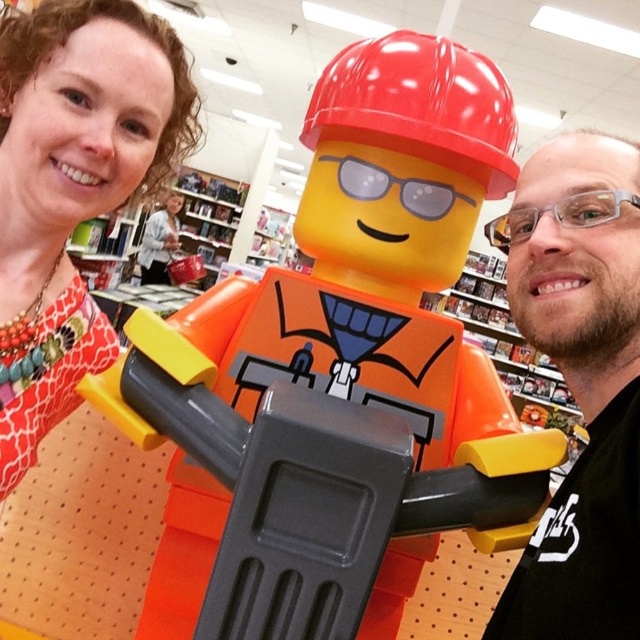
Question: Considering the relative positions of matte orange dress at center and transparent plastic goggles at right in the image provided, where is matte orange dress at center located with respect to transparent plastic goggles at right?

Choices:
 (A) above
 (B) below

Answer: (B)

Question: Which of these objects is positioned closest to the transparent plastic goggles at right?

Choices:
 (A) matte orange plastic construction worker at center
 (B) transparent plastic goggles at center
 (C) matte gray sweater at center
 (D) matte black shirt at center

Answer: (D)

Question: Which is farther from the matte black shirt at center?

Choices:
 (A) matte orange dress at center
 (B) transparent plastic goggles at center
 (C) transparent plastic goggles at right

Answer: (A)

Question: Observing the image, what is the correct spatial positioning of matte black shirt at center in reference to transparent plastic goggles at center?

Choices:
 (A) left
 (B) right

Answer: (B)

Question: Does matte orange plastic construction worker at center have a smaller size compared to matte black shirt at center?

Choices:
 (A) no
 (B) yes

Answer: (A)

Question: Among these objects, which one is nearest to the camera?

Choices:
 (A) transparent plastic goggles at center
 (B) matte gray sweater at center

Answer: (A)